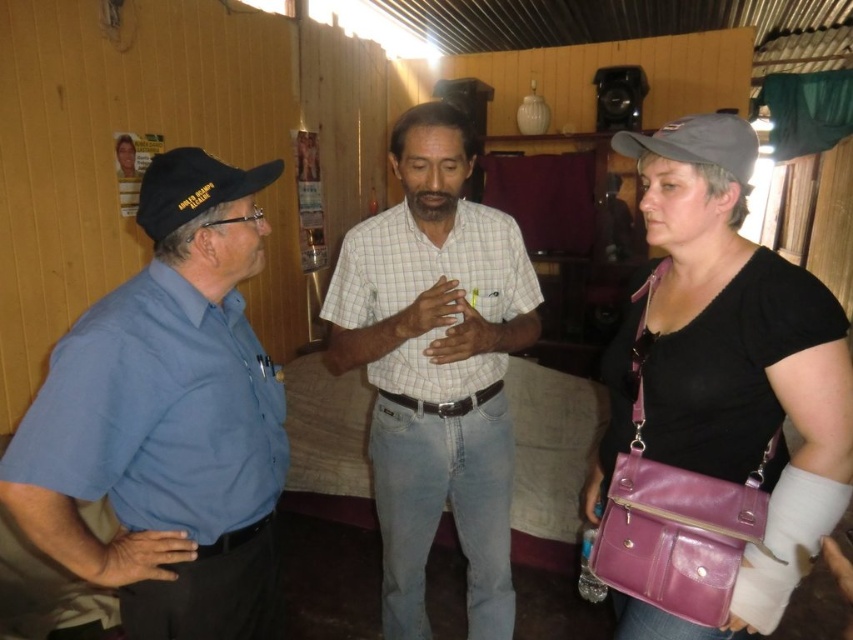
Question: Which of the following is the farthest from the observer?

Choices:
 (A) (772, 371)
 (B) (734, 179)
 (C) (177, 208)

Answer: (B)

Question: Considering the real-world distances, which object is farthest from the purple leather bag at center right?

Choices:
 (A) white checkered shirt at center
 (B) blue cotton shirt at left

Answer: (B)

Question: From the image, what is the correct spatial relationship of blue cotton shirt at left in relation to gray fabric baseball cap at upper right?

Choices:
 (A) below
 (B) above

Answer: (A)

Question: Among these objects, which one is nearest to the camera?

Choices:
 (A) gray fabric baseball cap at upper right
 (B) blue cotton shirt at left
 (C) white checkered shirt at center
 (D) purple leather bag at center right

Answer: (B)

Question: Does black fabric baseball cap at left appear on the left side of gray fabric baseball cap at upper right?

Choices:
 (A) yes
 (B) no

Answer: (A)

Question: From the image, what is the correct spatial relationship of purple leather bag at center right in relation to white checkered shirt at center?

Choices:
 (A) below
 (B) above

Answer: (B)